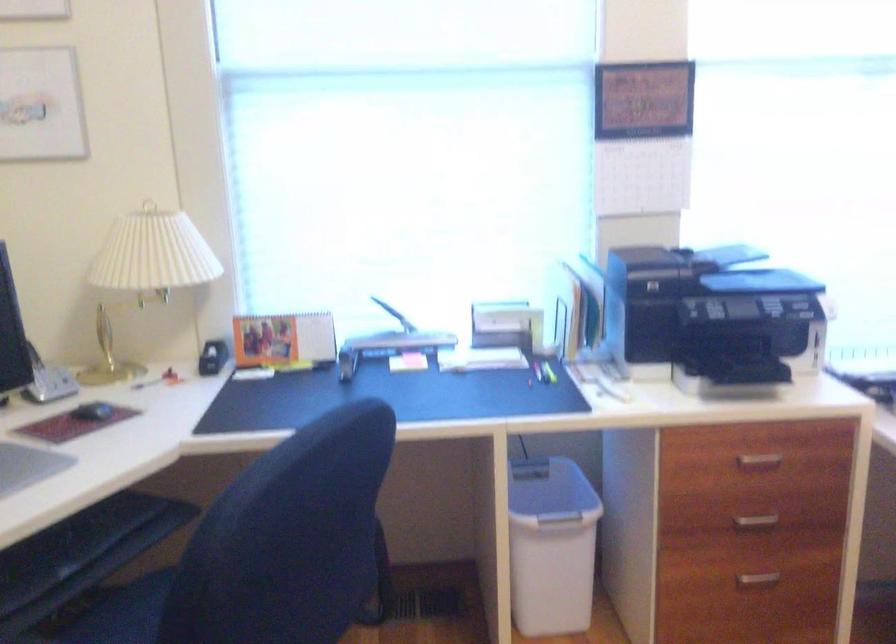
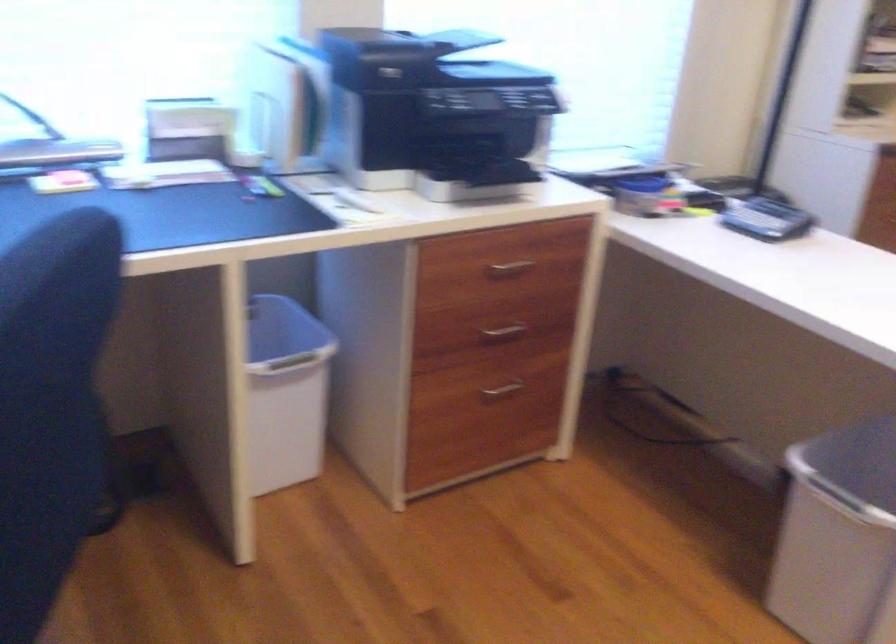
In the second image, find the point that corresponds to point (755, 522) in the first image.

(503, 330)